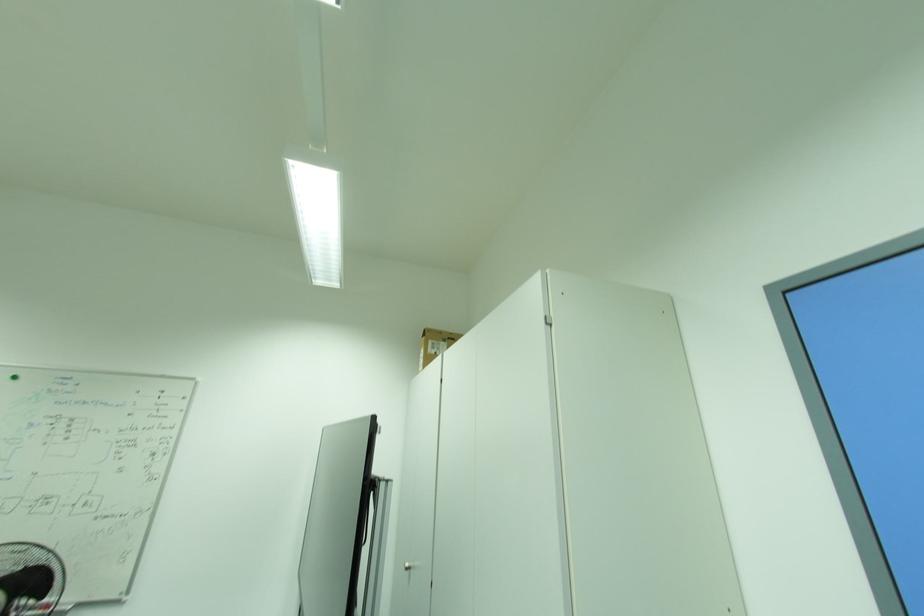
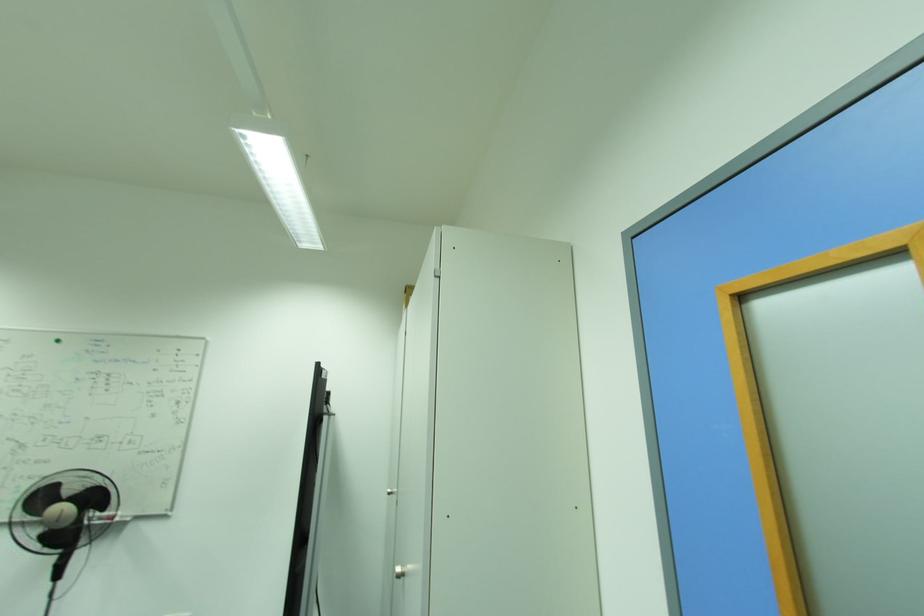
Question: The first image is from the beginning of the video and the second image is from the end. How did the camera likely rotate when shooting the video?

Choices:
 (A) Left
 (B) Right
 (C) Up
 (D) Down

Answer: (D)